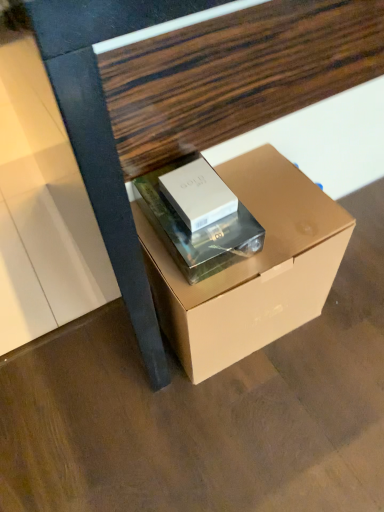
Find the location of `free location above matte white book at center (from a real-world perspective)`. free location above matte white book at center (from a real-world perspective) is located at coordinates (200, 222).